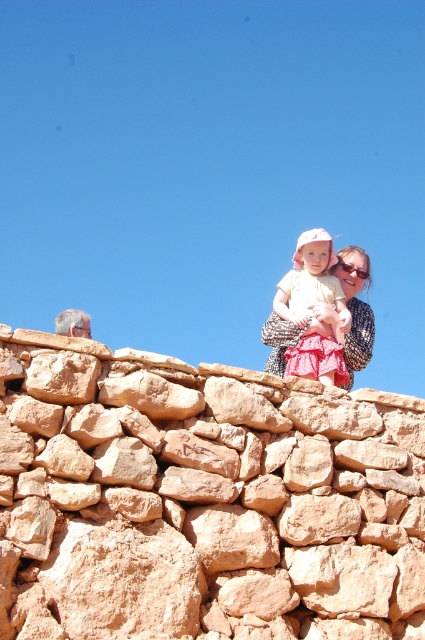
Is rustic stone wall at upper center further to camera compared to matte pink dress at upper center?

No, it is in front of matte pink dress at upper center.

Between rustic stone wall at upper center and matte pink dress at upper center, which one has less height?

Standing shorter between the two is rustic stone wall at upper center.

Between point (308, 444) and point (331, 253), which one is positioned in front?

Point (308, 444)

Locate an element on the screen. This screenshot has height=640, width=425. rustic stone wall at upper center is located at coordinates pos(201,500).